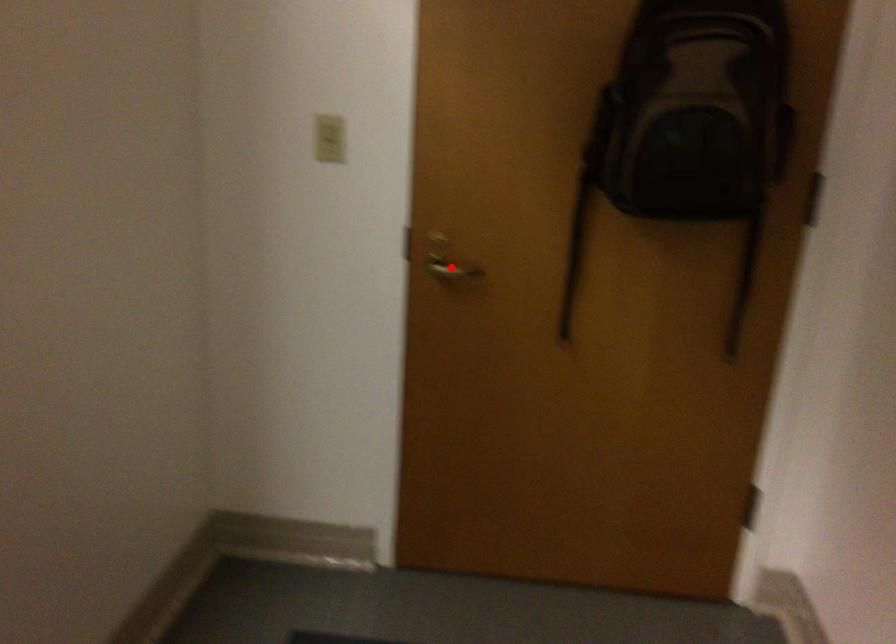
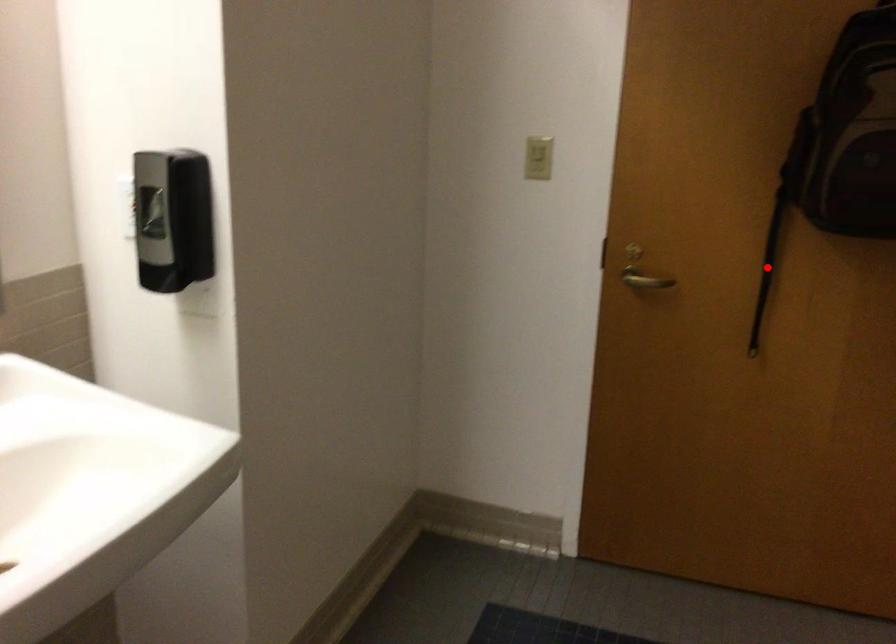
I am providing you with two images of the same scene from different viewpoints. A red point is marked on the first image and another point is marked on the second image. Does the point marked in image1 correspond to the same location as the one in image2?

No